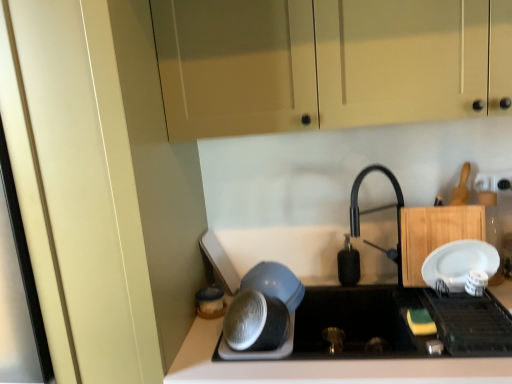
The height and width of the screenshot is (384, 512). In order to click on empty space that is to the right of black matte soap dispenser at center, placed as the 2th appliance when sorted from right to left in this screenshot , I will do `click(376, 281)`.